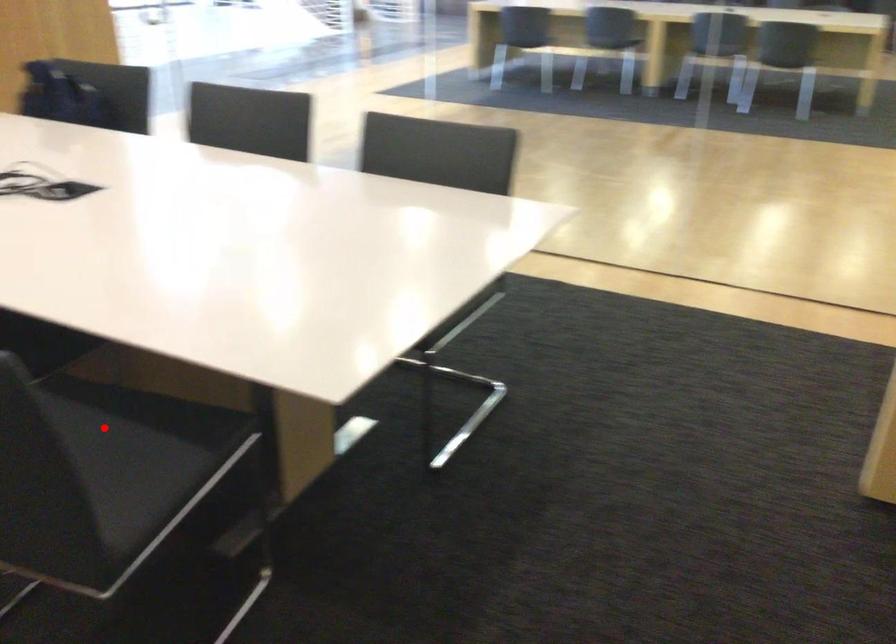
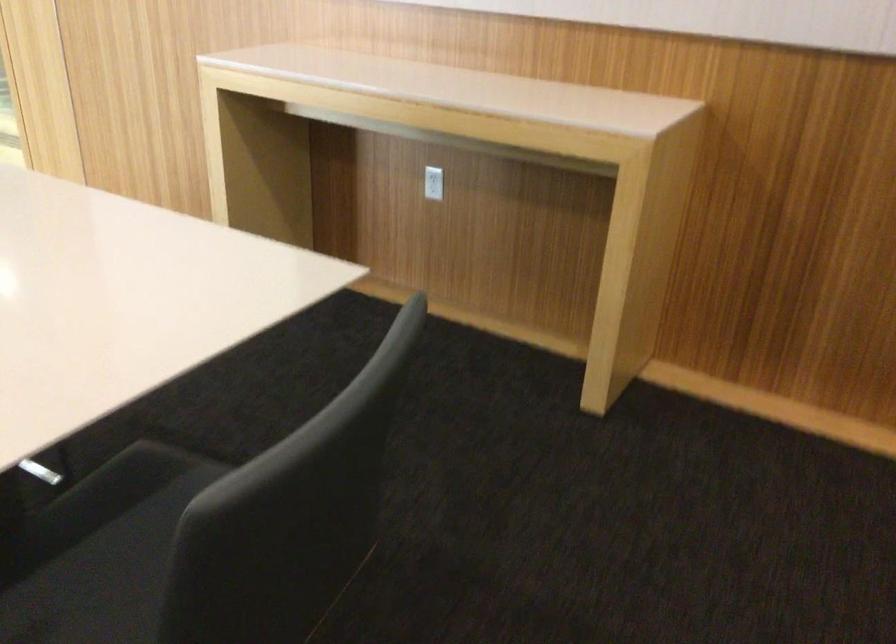
Where in the second image is the point corresponding to the highlighted location from the first image?

(101, 551)